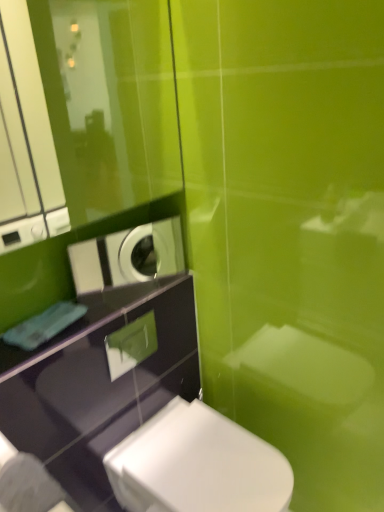
Describe the element at coordinates (145, 252) in the screenshot. This screenshot has width=384, height=512. I see `white glossy washing machine at upper left` at that location.

What is the approximate width of white glossy washing machine at upper left?

It is 1.38 inches.

Find the location of a particular element. The height and width of the screenshot is (512, 384). white glossy washing machine at upper left is located at coordinates (145, 252).

Measure the distance between white glossy toilet at lower center and camera.

white glossy toilet at lower center and camera are 3.81 feet apart from each other.

Find the location of a particular element. The height and width of the screenshot is (512, 384). white glossy toilet at lower center is located at coordinates (197, 465).

What do you see at coordinates (197, 465) in the screenshot? I see `white glossy toilet at lower center` at bounding box center [197, 465].

Where is `white glossy washing machine at upper left`? The image size is (384, 512). white glossy washing machine at upper left is located at coordinates (145, 252).

In the image, is white glossy toilet at lower center on the left side or the right side of white glossy washing machine at upper left?

Based on their positions, white glossy toilet at lower center is located to the right of white glossy washing machine at upper left.

Is white glossy toilet at lower center positioned in front of white glossy washing machine at upper left?

Yes, white glossy toilet at lower center is in front of white glossy washing machine at upper left.

Which point is more forward, (195, 488) or (157, 238)?

The point (195, 488) is in front.

From the image's perspective, is white glossy toilet at lower center positioned above or below white glossy washing machine at upper left?

Based on their image positions, white glossy toilet at lower center is located beneath white glossy washing machine at upper left.

From a real-world perspective, is white glossy toilet at lower center beneath white glossy washing machine at upper left?

Yes, from a real-world perspective, white glossy toilet at lower center is beneath white glossy washing machine at upper left.

Considering the relative sizes of white glossy toilet at lower center and white glossy washing machine at upper left in the image provided, is white glossy toilet at lower center wider than white glossy washing machine at upper left?

Yes.

Who is shorter, white glossy toilet at lower center or white glossy washing machine at upper left?

white glossy washing machine at upper left.

Between white glossy toilet at lower center and white glossy washing machine at upper left, which one has larger size?

Bigger between the two is white glossy toilet at lower center.

Would you say white glossy toilet at lower center is inside or outside white glossy washing machine at upper left?

white glossy toilet at lower center exists outside the volume of white glossy washing machine at upper left.

Are white glossy toilet at lower center and white glossy washing machine at upper left making contact?

white glossy toilet at lower center and white glossy washing machine at upper left are clearly separated.

Looking at this image, could you tell me if white glossy toilet at lower center is turned towards white glossy washing machine at upper left?

No, white glossy toilet at lower center is not oriented towards white glossy washing machine at upper left.

Find the location of a particular element. The width and height of the screenshot is (384, 512). toilet that appears below the white glossy washing machine at upper left (from the image's perspective) is located at coordinates (197, 465).

Is white glossy washing machine at upper left at the right side of white glossy toilet at lower center?

Incorrect, white glossy washing machine at upper left is not on the right side of white glossy toilet at lower center.

In the scene shown: Is white glossy washing machine at upper left in front of white glossy toilet at lower center?

No.

Does point (172, 230) come farther from viewer compared to point (182, 504)?

Yes, point (172, 230) is farther from viewer.

From the image's perspective, is white glossy washing machine at upper left on top of white glossy toilet at lower center?

Yes.

From a real-world perspective, which object stands above the other?

In real-world perspective, white glossy washing machine at upper left is above.

Is white glossy washing machine at upper left wider or thinner than white glossy toilet at lower center?

white glossy washing machine at upper left is thinner than white glossy toilet at lower center.

From the picture: Considering the relative sizes of white glossy washing machine at upper left and white glossy toilet at lower center in the image provided, is white glossy washing machine at upper left shorter than white glossy toilet at lower center?

Correct, white glossy washing machine at upper left is not as tall as white glossy toilet at lower center.

Considering the sizes of objects white glossy washing machine at upper left and white glossy toilet at lower center in the image provided, who is bigger, white glossy washing machine at upper left or white glossy toilet at lower center?

Bigger between the two is white glossy toilet at lower center.

Is white glossy washing machine at upper left located outside white glossy toilet at lower center?

Yes, white glossy washing machine at upper left is located beyond the bounds of white glossy toilet at lower center.

Are white glossy washing machine at upper left and white glossy toilet at lower center located far from each other?

No.

Is white glossy washing machine at upper left turned away from white glossy toilet at lower center?

No, white glossy washing machine at upper left is not facing away from white glossy toilet at lower center.

Consider the image. What's the angular difference between white glossy washing machine at upper left and white glossy toilet at lower center's facing directions?

23.5 degrees separate the facing orientations of white glossy washing machine at upper left and white glossy toilet at lower center.

This screenshot has width=384, height=512. Identify the location of appliance lying behind the white glossy toilet at lower center. (145, 252).

You are a GUI agent. You are given a task and a screenshot of the screen. Output one action in this format:
    pyautogui.click(x=<x>, y=<y>)
    Task: Click on the toilet beneath the white glossy washing machine at upper left (from a real-world perspective)
    
    Given the screenshot: What is the action you would take?
    pyautogui.click(x=197, y=465)

Locate an element on the screen. The image size is (384, 512). appliance above the white glossy toilet at lower center (from the image's perspective) is located at coordinates (145, 252).